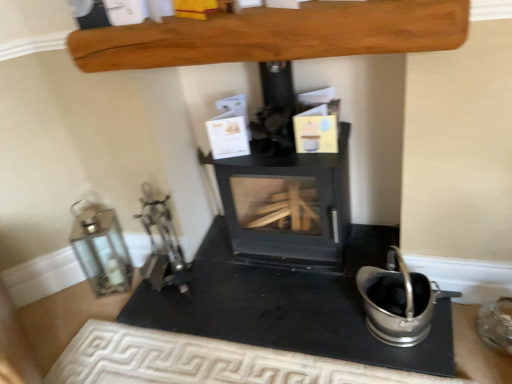
You are a GUI agent. You are given a task and a screenshot of the screen. Output one action in this format:
    pyautogui.click(x=<x>, y=<y>)
    Task: Click on the vacant space positioned to the left of satin silver bucket at lower right, acting as the 2th appliance starting from the left
    
    Given the screenshot: What is the action you would take?
    pyautogui.click(x=326, y=316)